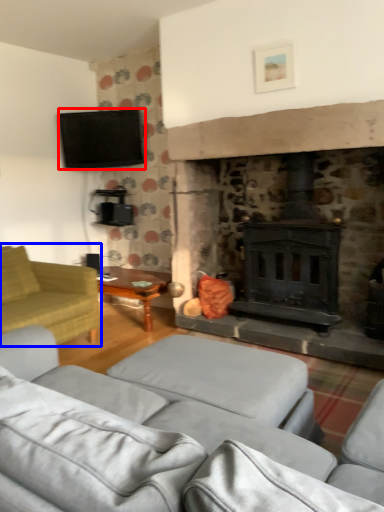
Question: Which point is closer to the camera, television (highlighted by a red box) or studio couch (highlighted by a blue box)?

Choices:
 (A) television
 (B) studio couch

Answer: (B)